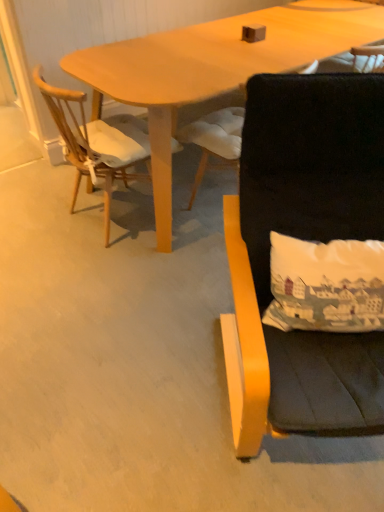
The height and width of the screenshot is (512, 384). I want to click on free region under wooden chair at left, marked as the 1th chair in a left-to-right arrangement (from a real-world perspective), so click(115, 217).